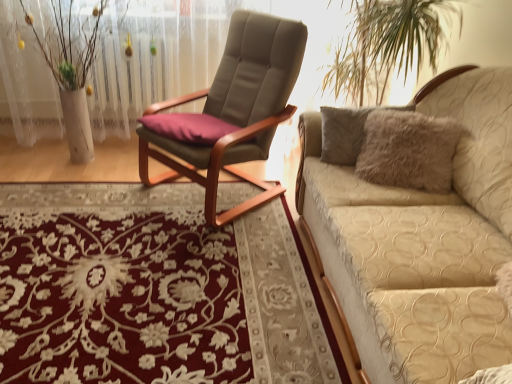
Question: Is suede-like beige chair at center smaller than beige quilted couch at right?

Choices:
 (A) no
 (B) yes

Answer: (B)

Question: Is suede-like beige chair at center oriented away from beige quilted couch at right?

Choices:
 (A) yes
 (B) no

Answer: (B)

Question: From the image's perspective, would you say suede-like beige chair at center is shown under beige quilted couch at right?

Choices:
 (A) no
 (B) yes

Answer: (A)

Question: Is suede-like beige chair at center positioned in front of beige quilted couch at right?

Choices:
 (A) yes
 (B) no

Answer: (B)

Question: Can you confirm if suede-like beige chair at center is taller than beige quilted couch at right?

Choices:
 (A) no
 (B) yes

Answer: (B)

Question: From a real-world perspective, is white textured vase at left physically located above or below floral carpet at center?

Choices:
 (A) below
 (B) above

Answer: (B)

Question: Do you think white textured vase at left is within floral carpet at center, or outside of it?

Choices:
 (A) inside
 (B) outside

Answer: (B)

Question: Considering the positions of white textured vase at left and floral carpet at center in the image, is white textured vase at left wider or thinner than floral carpet at center?

Choices:
 (A) thin
 (B) wide

Answer: (A)

Question: Considering the relative positions of white textured vase at left and floral carpet at center in the image provided, is white textured vase at left to the left or to the right of floral carpet at center?

Choices:
 (A) left
 (B) right

Answer: (A)

Question: Is floral carpet at center to the left or to the right of white textured vase at left in the image?

Choices:
 (A) right
 (B) left

Answer: (A)

Question: Considering the positions of floral carpet at center and white textured vase at left in the image, is floral carpet at center wider or thinner than white textured vase at left?

Choices:
 (A) thin
 (B) wide

Answer: (B)

Question: From their relative heights in the image, would you say floral carpet at center is taller or shorter than white textured vase at left?

Choices:
 (A) short
 (B) tall

Answer: (A)

Question: From the image's perspective, is floral carpet at center above or below white textured vase at left?

Choices:
 (A) above
 (B) below

Answer: (B)

Question: In terms of height, does suede-like beige chair at center look taller or shorter compared to floral carpet at center?

Choices:
 (A) short
 (B) tall

Answer: (B)

Question: Considering the relative positions of suede-like beige chair at center and floral carpet at center in the image provided, is suede-like beige chair at center to the left or to the right of floral carpet at center?

Choices:
 (A) left
 (B) right

Answer: (B)